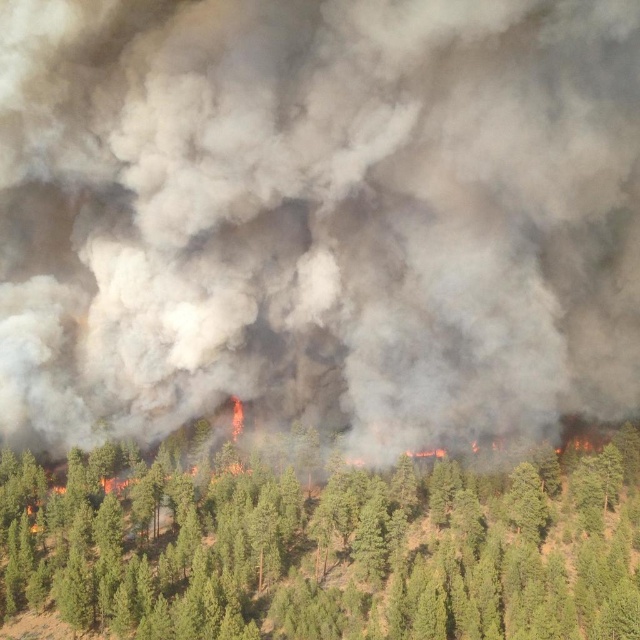
Is gray matte smoke at center below green leafy tree at center?

Incorrect, gray matte smoke at center is not positioned below green leafy tree at center.

Does gray matte smoke at center have a greater height compared to green leafy tree at center?

Yes.

Between point (365, 280) and point (552, 456), which one is positioned behind?

Positioned behind is point (365, 280).

This screenshot has height=640, width=640. In order to click on gray matte smoke at center in this screenshot , I will do `click(317, 209)`.